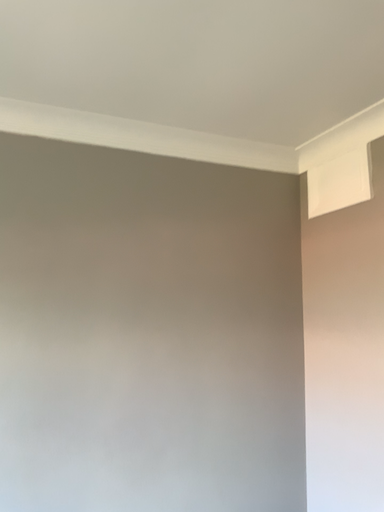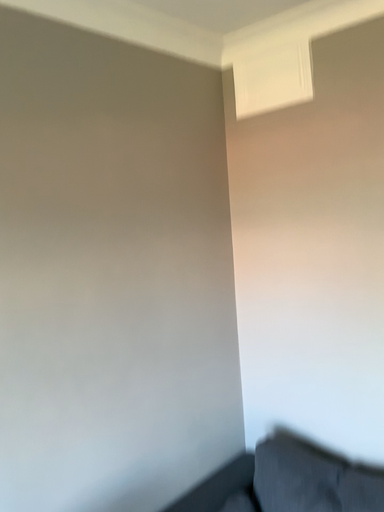
Question: How did the camera likely rotate when shooting the video?

Choices:
 (A) rotated right
 (B) rotated left

Answer: (A)